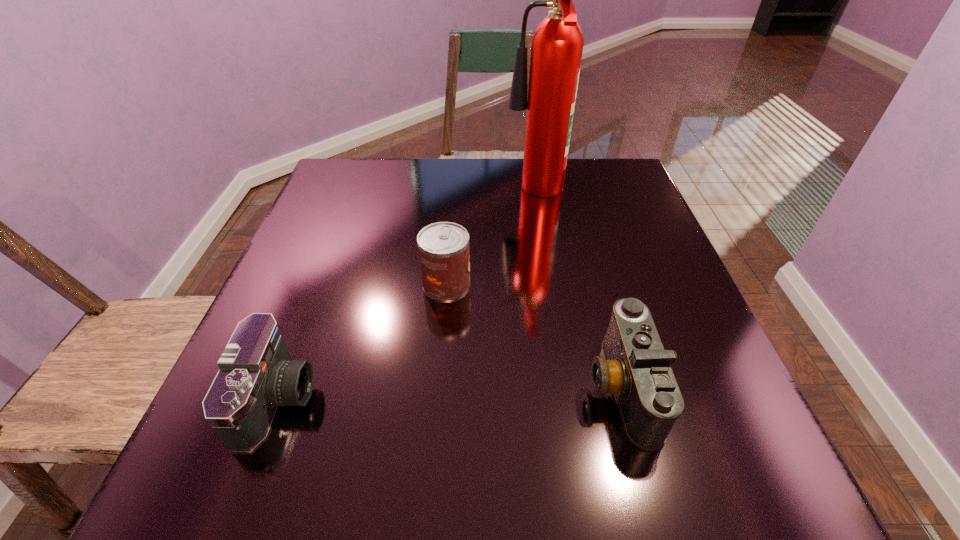
Where is `free space at the near edge of the desktop`? Image resolution: width=960 pixels, height=540 pixels. free space at the near edge of the desktop is located at coordinates (565, 460).

I want to click on vacant space at the left edge of the desktop, so click(x=288, y=303).

The image size is (960, 540). I want to click on free space at the right edge of the desktop, so click(x=667, y=328).

At what (x,y) coordinates should I click in order to perform the action: click on blank space at the far left corner. Please return your answer as a coordinate pair (x, y). This screenshot has height=540, width=960. Looking at the image, I should click on (372, 204).

Where is `vacant space at the near left corner of the desktop`? The image size is (960, 540). vacant space at the near left corner of the desktop is located at coordinates (263, 472).

Where is `free space at the far right corner`? Image resolution: width=960 pixels, height=540 pixels. free space at the far right corner is located at coordinates (x=612, y=160).

Locate an element on the screen. free space between the right camera and the third object from right to left is located at coordinates (534, 335).

Image resolution: width=960 pixels, height=540 pixels. In order to click on free area in between the third object from right to left and the right camera in this screenshot , I will do `click(534, 335)`.

Locate an element on the screen. The height and width of the screenshot is (540, 960). free space that is in between the left camera and the right camera is located at coordinates (449, 392).

This screenshot has width=960, height=540. Identify the location of vacant region between the leftmost object and the can. (362, 341).